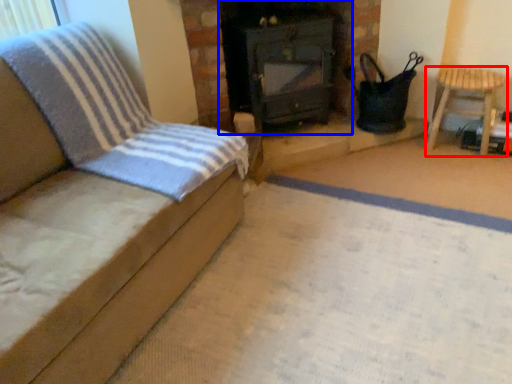
Question: Which point is further to the camera, furniture (highlighted by a red box) or stove (highlighted by a blue box)?

Choices:
 (A) furniture
 (B) stove

Answer: (A)